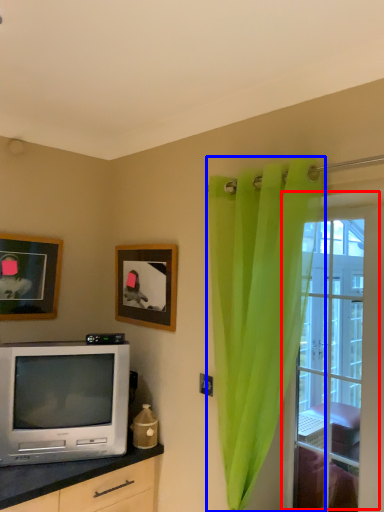
Question: Which point is further to the camera, window (highlighted by a red box) or curtain (highlighted by a blue box)?

Choices:
 (A) window
 (B) curtain

Answer: (A)